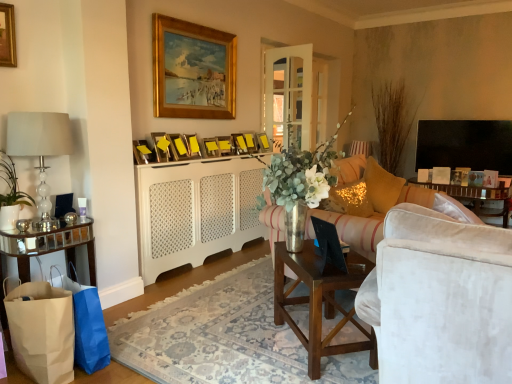
Image resolution: width=512 pixels, height=384 pixels. I want to click on yellow matte picture frame at center, which ranks as the 4th picture frame in right-to-left order, so click(x=224, y=145).

The height and width of the screenshot is (384, 512). In order to click on yellow cardboard picture frame at center, which is the seventh picture frame in right-to-left order in this screenshot , I will do `click(192, 146)`.

What is the approximate width of glittery yellow pillow at right, positioned as the 2th pillow in front-to-back order?

It is 16.69 inches.

Where is `glittery yellow pillow at right, which ranks as the first pillow in back-to-front order`? This screenshot has width=512, height=384. glittery yellow pillow at right, which ranks as the first pillow in back-to-front order is located at coordinates (381, 186).

At what (x,y) coordinates should I click in order to perform the action: click on gold wooden picture frame at upper left, arranged as the eleventh picture frame when viewed from the right. Please return your answer as a coordinate pair (x, y). Looking at the image, I should click on (7, 36).

What do you see at coordinates (263, 142) in the screenshot? The width and height of the screenshot is (512, 384). I see `yellow paper picture frame at center, which is counted as the 1th picture frame, starting from the right` at bounding box center [263, 142].

Find the location of a particular element. The image size is (512, 384). yellow matte picture frame at center, which ranks as the 4th picture frame in right-to-left order is located at coordinates (224, 145).

Which object is further away from the camera taking this photo, yellow cardboard picture frame at center, which is the seventh picture frame in right-to-left order, or yellow matte picture frame at center, placed as the 4th picture frame when sorted from left to right?

yellow cardboard picture frame at center, which is the seventh picture frame in right-to-left order, is more distant.

Are yellow cardboard picture frame at center, arranged as the fifth picture frame when viewed from the left, and yellow matte picture frame at center, placed as the 4th picture frame when sorted from left to right, far apart?

No, yellow cardboard picture frame at center, arranged as the fifth picture frame when viewed from the left, is in close proximity to yellow matte picture frame at center, placed as the 4th picture frame when sorted from left to right.

From a real-world perspective, is yellow cardboard picture frame at center, arranged as the fifth picture frame when viewed from the left, physically above yellow matte picture frame at center, placed as the eighth picture frame when sorted from right to left?

Actually, yellow cardboard picture frame at center, arranged as the fifth picture frame when viewed from the left, is physically below yellow matte picture frame at center, placed as the eighth picture frame when sorted from right to left, in the real world.

Can you tell me how much yellow cardboard picture frame at center, arranged as the fifth picture frame when viewed from the left, and yellow matte picture frame at center, placed as the 4th picture frame when sorted from left to right, differ in facing direction?

They differ by 14.1 degrees in their facing directions.

Can you see sparkly gold pillow at right, arranged as the 1th pillow when viewed from the front, touching glittery yellow pillow at right, positioned as the 2th pillow in front-to-back order?

No, sparkly gold pillow at right, arranged as the 1th pillow when viewed from the front, is not touching glittery yellow pillow at right, positioned as the 2th pillow in front-to-back order.

In the scene shown: Does sparkly gold pillow at right, the second pillow viewed from the back, have a larger size compared to glittery yellow pillow at right, which ranks as the first pillow in back-to-front order?

No, sparkly gold pillow at right, the second pillow viewed from the back, is not bigger than glittery yellow pillow at right, which ranks as the first pillow in back-to-front order.

Who is more distant, sparkly gold pillow at right, the second pillow viewed from the back, or glittery yellow pillow at right, which ranks as the first pillow in back-to-front order?

glittery yellow pillow at right, which ranks as the first pillow in back-to-front order, is more distant.

Does sparkly gold pillow at right, the second pillow viewed from the back, turn towards glittery yellow pillow at right, positioned as the 2th pillow in front-to-back order?

No, sparkly gold pillow at right, the second pillow viewed from the back, does not turn towards glittery yellow pillow at right, positioned as the 2th pillow in front-to-back order.

Is wooden table at center, acting as the 1th table starting from the right, next to metallic gold picture frame at center, acting as the 9th picture frame starting from the left, and touching it?

wooden table at center, acting as the 1th table starting from the right, and metallic gold picture frame at center, acting as the 9th picture frame starting from the left, are not in contact.

Between point (370, 327) and point (240, 146), which one is positioned behind?

The point (240, 146) is farther.

In the scene shown: Considering the sizes of wooden table at center, which appears as the 2th table when viewed from the left, and metallic gold picture frame at center, which ranks as the third picture frame in right-to-left order, in the image, is wooden table at center, which appears as the 2th table when viewed from the left, taller or shorter than metallic gold picture frame at center, which ranks as the third picture frame in right-to-left order,?

Clearly, wooden table at center, which appears as the 2th table when viewed from the left, is taller compared to metallic gold picture frame at center, which ranks as the third picture frame in right-to-left order.

Is wooden table at center, acting as the 1th table starting from the right, completely or partially outside of metallic gold picture frame at center, acting as the 9th picture frame starting from the left?

wooden table at center, acting as the 1th table starting from the right, lies outside metallic gold picture frame at center, acting as the 9th picture frame starting from the left,'s area.

In the image, is metallic gold picture frame at center, positioned as the second picture frame in right-to-left order, positioned in front of or behind metallic gold picture frame at center, acting as the 9th picture frame starting from the left?

In the image, metallic gold picture frame at center, positioned as the second picture frame in right-to-left order, appears behind metallic gold picture frame at center, acting as the 9th picture frame starting from the left.

Can you tell me how much metallic gold picture frame at center, arranged as the 10th picture frame when viewed from the left, and metallic gold picture frame at center, which ranks as the third picture frame in right-to-left order, differ in facing direction?

19.7 degrees.

Is metallic gold picture frame at center, arranged as the 10th picture frame when viewed from the left, not inside metallic gold picture frame at center, acting as the 9th picture frame starting from the left?

Yes, metallic gold picture frame at center, arranged as the 10th picture frame when viewed from the left, is outside of metallic gold picture frame at center, acting as the 9th picture frame starting from the left.

In order to click on the 1st lamp above the white ceramic vase at left (from the image's perspective) in this screenshot , I will do `click(39, 145)`.

Which is more to the left, white ceramic vase at left or clear glass lamp at left, which is counted as the 1th lamp, starting from the left?

From the viewer's perspective, white ceramic vase at left appears more on the left side.

Is point (22, 202) positioned after point (48, 200)?

No, (22, 202) is in front of (48, 200).

Can you confirm if white ceramic vase at left is taller than clear glass lamp at left, which is counted as the 2th lamp, starting from the back?

No.

Between point (244, 148) and point (359, 199), which one is positioned behind?

Point (244, 148)

From a real-world perspective, is metallic gold picture frame at center, acting as the 9th picture frame starting from the left, positioned above or below sparkly gold pillow at right, the second pillow viewed from the back?

From a real-world perspective, metallic gold picture frame at center, acting as the 9th picture frame starting from the left, is physically above sparkly gold pillow at right, the second pillow viewed from the back.

Locate an element on the screen. This screenshot has height=384, width=512. the 5th picture frame behind the sparkly gold pillow at right, arranged as the 1th pillow when viewed from the front is located at coordinates (240, 144).

Which object is further away from the camera taking this photo, yellow matte picture frame at center, which ranks as the 4th picture frame in right-to-left order, or clear glass lamp at left, the first lamp when ordered from bottom to top?

yellow matte picture frame at center, which ranks as the 4th picture frame in right-to-left order, is more distant.

Can you confirm if yellow matte picture frame at center, which ranks as the 4th picture frame in right-to-left order, is thinner than clear glass lamp at left, the first lamp when ordered from bottom to top?

Indeed, yellow matte picture frame at center, which ranks as the 4th picture frame in right-to-left order, has a lesser width compared to clear glass lamp at left, the first lamp when ordered from bottom to top.

Is yellow matte picture frame at center, which ranks as the 4th picture frame in right-to-left order, facing away from clear glass lamp at left, the 2th lamp viewed from the right?

No.

How distant is yellow matte picture frame at center, which ranks as the 4th picture frame in right-to-left order, from clear glass lamp at left, the 2th lamp viewed from the top?

1.61 meters.

This screenshot has width=512, height=384. In order to click on picture frame that is the 2nd object located below the yellow cardboard picture frame at center, which is the seventh picture frame in right-to-left order (from the image's perspective) in this screenshot , I will do `click(178, 147)`.

I want to click on pillow located on the right of sparkly gold pillow at right, the second pillow viewed from the back, so click(381, 186).

Looking at the image, which one is located further to metallic gold picture frame at center, which ranks as the third picture frame in right-to-left order, yellow cardboard picture frame at center, which is the seventh picture frame in right-to-left order, or yellow matte picture frame at center, marked as the eighth picture frame in a left-to-right arrangement?

Based on the image, yellow cardboard picture frame at center, which is the seventh picture frame in right-to-left order, appears to be further to metallic gold picture frame at center, which ranks as the third picture frame in right-to-left order.

Looking at the image, which one is located closer to gold wooden picture frame at upper left, placed as the 1th picture frame when sorted from left to right, matte gold picture frame at center, which is counted as the third picture frame, starting from the left, or yellow cardboard picture frame at center, arranged as the fifth picture frame when viewed from the left?

A: Based on the image, matte gold picture frame at center, which is counted as the third picture frame, starting from the left, appears to be nearer to gold wooden picture frame at upper left, placed as the 1th picture frame when sorted from left to right.

From the picture: When comparing their distances from white paper bag at lower left, the 1th shopping bag in the back-to-front sequence, does brown paper bag at lower left, which is counted as the 1th shopping bag, starting from the front, or white ceramic vase at left seem further?

white ceramic vase at left is further to white paper bag at lower left, the 1th shopping bag in the back-to-front sequence.

Which object lies nearer to the anchor point yellow paper picture frame at center, which is counted as the 1th picture frame, starting from the right, glittery yellow pillow at right, which ranks as the first pillow in back-to-front order, or yellow matte picture frame at center, placed as the 4th picture frame when sorted from left to right?

Among the two, yellow matte picture frame at center, placed as the 4th picture frame when sorted from left to right, is located nearer to yellow paper picture frame at center, which is counted as the 1th picture frame, starting from the right.

Which object lies further to the anchor point yellow matte picture frame at center, placed as the 4th picture frame when sorted from left to right, matte glass lamp at upper center, the second lamp when ordered from left to right, or sparkly gold pillow at right, arranged as the 1th pillow when viewed from the front?

matte glass lamp at upper center, the second lamp when ordered from left to right, lies further to yellow matte picture frame at center, placed as the 4th picture frame when sorted from left to right, than the other object.

When comparing their distances from yellow paper picture frame at center, which is counted as the 1th picture frame, starting from the right, does white paper bag at lower left, placed as the 2th shopping bag when sorted from front to back, or clear glass lamp at left, the 2th lamp viewed from the right, seem further?

white paper bag at lower left, placed as the 2th shopping bag when sorted from front to back, is positioned further to the anchor yellow paper picture frame at center, which is counted as the 1th picture frame, starting from the right.

From the image, which object appears to be farther from metallic gold picture frame at center, which ranks as the third picture frame in right-to-left order, metallic gold picture frame at center, which appears as the fifth picture frame when viewed from the right, or matte gold picture frame at center, which is counted as the third picture frame, starting from the left?

Among the two, matte gold picture frame at center, which is counted as the third picture frame, starting from the left, is located further to metallic gold picture frame at center, which ranks as the third picture frame in right-to-left order.

When comparing their distances from gold wooden picture frame at upper left, arranged as the eleventh picture frame when viewed from the right, does matte gold picture frame at center, which is counted as the third picture frame, starting from the left, or white ceramic vase at left seem closer?

white ceramic vase at left is positioned closer to the anchor gold wooden picture frame at upper left, arranged as the eleventh picture frame when viewed from the right.

What are the coordinates of `lamp located between wooden table at center, acting as the 1th table starting from the right, and yellow paper picture frame at center, acting as the 11th picture frame starting from the left, in the depth direction` in the screenshot? It's located at (39, 145).

Image resolution: width=512 pixels, height=384 pixels. I want to click on dresser between brown paper bag at lower left, which is counted as the 1th shopping bag, starting from the front, and glittery yellow pillow at right, positioned as the 2th pillow in front-to-back order, so click(196, 211).

Where is `lamp between wooden table at center, acting as the 1th table starting from the right, and metallic gold picture frame at center, arranged as the 10th picture frame when viewed from the left, from front to back`? Image resolution: width=512 pixels, height=384 pixels. lamp between wooden table at center, acting as the 1th table starting from the right, and metallic gold picture frame at center, arranged as the 10th picture frame when viewed from the left, from front to back is located at coordinates (39, 145).

Locate an element on the screen. The width and height of the screenshot is (512, 384). table between clear glass lamp at left, which is counted as the 2th lamp, starting from the back, and yellow matte picture frame at center, marked as the eighth picture frame in a left-to-right arrangement, along the z-axis is located at coordinates (49, 247).